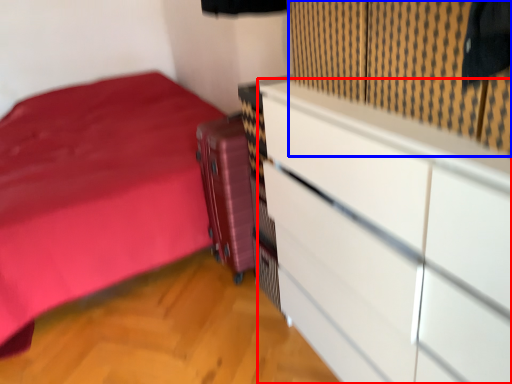
Question: Among these objects, which one is farthest to the camera, chest of drawers (highlighted by a red box) or curtain (highlighted by a blue box)?

Choices:
 (A) chest of drawers
 (B) curtain

Answer: (B)